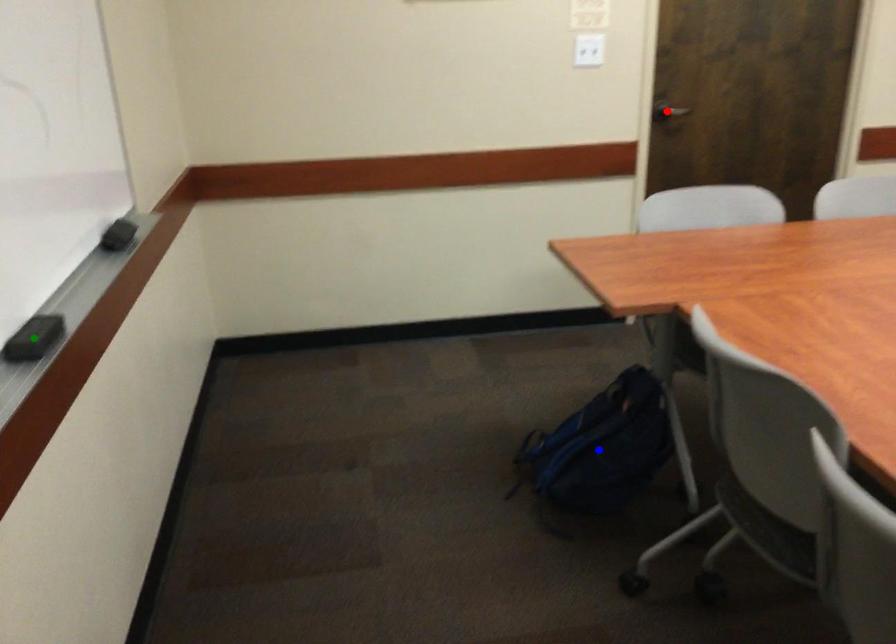
Order these from nearest to farthest:
green point
red point
blue point

green point
blue point
red point